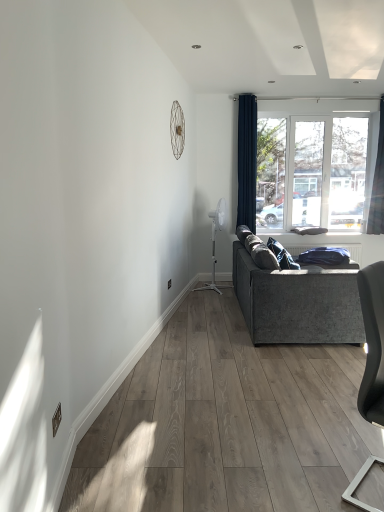
Question: Is velvet grey couch at right further to camera compared to dark blue fabric curtain at right, placed as the 2th curtain when sorted from left to right?

Choices:
 (A) yes
 (B) no

Answer: (B)

Question: Is the depth of velvet grey couch at right less than that of dark blue fabric curtain at right, placed as the 1th curtain when sorted from right to left?

Choices:
 (A) no
 (B) yes

Answer: (B)

Question: Is the surface of velvet grey couch at right in direct contact with dark blue fabric curtain at right, placed as the 2th curtain when sorted from left to right?

Choices:
 (A) no
 (B) yes

Answer: (A)

Question: Would you say velvet grey couch at right is a long distance from dark blue fabric curtain at right, placed as the 1th curtain when sorted from right to left?

Choices:
 (A) yes
 (B) no

Answer: (A)

Question: Is velvet grey couch at right thinner than dark blue fabric curtain at right, placed as the 1th curtain when sorted from right to left?

Choices:
 (A) no
 (B) yes

Answer: (A)

Question: From the image's perspective, does velvet grey couch at right appear lower than dark blue fabric curtain at right, placed as the 1th curtain when sorted from right to left?

Choices:
 (A) yes
 (B) no

Answer: (A)

Question: Is navy blue fabric curtain at upper right, which is the 1th curtain from left to right, in front of transparent glass window at upper right?

Choices:
 (A) yes
 (B) no

Answer: (A)

Question: Can you confirm if navy blue fabric curtain at upper right, marked as the second curtain in a right-to-left arrangement, is smaller than transparent glass window at upper right?

Choices:
 (A) no
 (B) yes

Answer: (B)

Question: Is navy blue fabric curtain at upper right, marked as the second curtain in a right-to-left arrangement, bigger than transparent glass window at upper right?

Choices:
 (A) yes
 (B) no

Answer: (B)

Question: Is navy blue fabric curtain at upper right, which is the 1th curtain from left to right, further to camera compared to transparent glass window at upper right?

Choices:
 (A) no
 (B) yes

Answer: (A)

Question: Does navy blue fabric curtain at upper right, marked as the second curtain in a right-to-left arrangement, appear on the left side of transparent glass window at upper right?

Choices:
 (A) yes
 (B) no

Answer: (A)

Question: Can you confirm if navy blue fabric curtain at upper right, which is the 1th curtain from left to right, is wider than transparent glass window at upper right?

Choices:
 (A) yes
 (B) no

Answer: (A)

Question: Considering the relative sizes of dark blue fabric curtain at right, placed as the 2th curtain when sorted from left to right, and matte gray chair at lower right in the image provided, is dark blue fabric curtain at right, placed as the 2th curtain when sorted from left to right, bigger than matte gray chair at lower right?

Choices:
 (A) no
 (B) yes

Answer: (A)